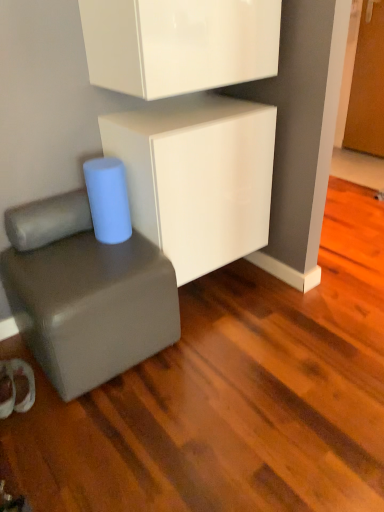
Question: Considering the relative positions of matte gray cube at lower left and white glossy cabinet at center, which appears as the 2th cabinetry when viewed from the top, in the image provided, is matte gray cube at lower left to the left or to the right of white glossy cabinet at center, which appears as the 2th cabinetry when viewed from the top,?

Choices:
 (A) right
 (B) left

Answer: (B)

Question: From the image's perspective, is matte gray cube at lower left above or below white glossy cabinet at center, marked as the first cabinetry in a bottom-to-top arrangement?

Choices:
 (A) below
 (B) above

Answer: (A)

Question: Which is farther from the white glossy cabinet at center, marked as the first cabinetry in a bottom-to-top arrangement?

Choices:
 (A) glossy white cabinet at upper center, which is counted as the 2th cabinetry, starting from the bottom
 (B) matte gray cube at lower left

Answer: (B)

Question: Estimate the real-world distances between objects in this image. Which object is closer to the matte gray cube at lower left?

Choices:
 (A) white glossy cabinet at center, marked as the first cabinetry in a bottom-to-top arrangement
 (B) glossy white cabinet at upper center, which is counted as the 2th cabinetry, starting from the bottom

Answer: (A)